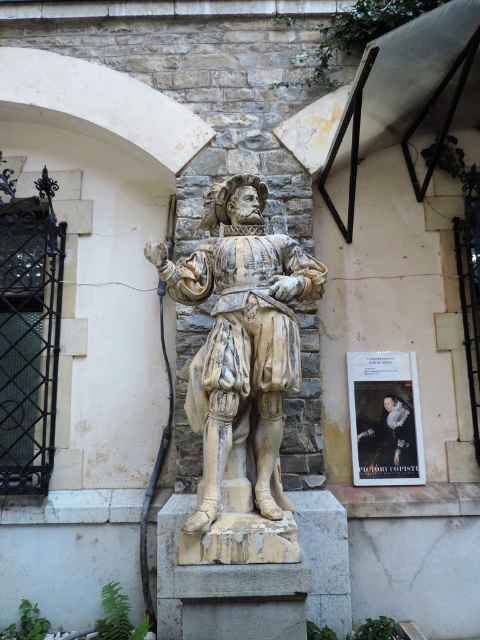
You are an art restorer assessing two statues in a courtyard. You have to decide which statue requires a taller support structure. The statues are the white marble statue at center and the smooth cream statue at center. Which one needs a taller support structure?

The white marble statue at center has a greater height compared to the smooth cream statue at center, so it requires a taller support structure.

You are a tour guide leading a group of visitors. You want to ensure that the visitors can comfortably walk around both the white marble statue at center and the smooth cream statue at center. What is the minimum width of the path needed between the statues to allow a visitor with a 1.2 meter wide wheelchair to pass through comfortably?

The distance between the white marble statue at center and the smooth cream statue at center is 1.47 meters. Since the wheelchair is 1.2 meters wide, the path between them is wide enough to accommodate the wheelchair comfortably.

You are an art restorer examining the statues in the image. You notice that the white marble statue at center and the smooth cream statue at center are both in need of restoration. Which statue is located to the left of the other?

The white marble statue at center is positioned on the left side of the smooth cream statue at center.